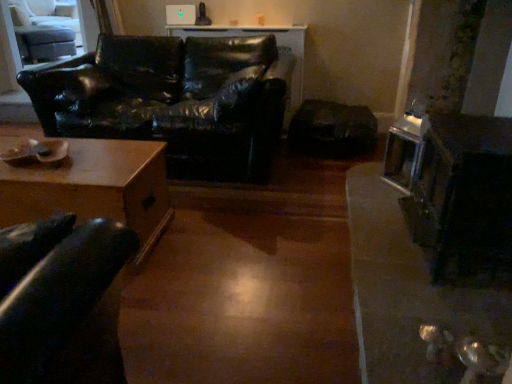
Locate an element on the screen. metallic silver fireplace at right is located at coordinates (460, 197).

Find the location of a particular element. wooden table at lower left is located at coordinates (95, 188).

Find the location of a particular element. The height and width of the screenshot is (384, 512). light gray fabric swivel chair at upper left is located at coordinates (41, 39).

Is point (42, 59) positioned before point (74, 192)?

That is False.

Does light gray fabric swivel chair at upper left appear on the right side of wooden table at lower left?

In fact, light gray fabric swivel chair at upper left is to the left of wooden table at lower left.

Is light gray fabric swivel chair at upper left situated inside wooden table at lower left or outside?

The correct answer is: outside.

You are a GUI agent. You are given a task and a screenshot of the screen. Output one action in this format:
    pyautogui.click(x=<x>, y=<y>)
    Task: Click on the swivel chair above the metallic silver fireplace at right (from the image's perspective)
    The width and height of the screenshot is (512, 384).
    Given the screenshot: What is the action you would take?
    (x=41, y=39)

From the image's perspective, is light gray fabric swivel chair at upper left positioned above or below metallic silver fireplace at right?

light gray fabric swivel chair at upper left is above metallic silver fireplace at right.

Does point (61, 54) appear closer or farther from the camera than point (454, 231)?

Clearly, point (61, 54) is more distant from the camera than point (454, 231).

Are light gray fabric swivel chair at upper left and metallic silver fireplace at right far apart?

light gray fabric swivel chair at upper left is positioned a significant distance from metallic silver fireplace at right.

Which of these two, wooden table at lower left or light gray fabric swivel chair at upper left, is wider?

With larger width is wooden table at lower left.

Looking at this image, from a real-world perspective, which is physically below, wooden table at lower left or light gray fabric swivel chair at upper left?

wooden table at lower left, from a real-world perspective.

Is wooden table at lower left inside or outside of light gray fabric swivel chair at upper left?

wooden table at lower left cannot be found inside light gray fabric swivel chair at upper left.

From the image's perspective, is black leather couch at left above light gray fabric swivel chair at upper left?

Actually, black leather couch at left appears below light gray fabric swivel chair at upper left in the image.

Who is shorter, black leather couch at left or light gray fabric swivel chair at upper left?

light gray fabric swivel chair at upper left.

From the picture: Which object is positioned more to the right, black leather couch at left or light gray fabric swivel chair at upper left?

black leather couch at left.

Does black leather couch at left have a smaller size compared to light gray fabric swivel chair at upper left?

Actually, black leather couch at left might be larger than light gray fabric swivel chair at upper left.

Is wooden table at lower left not within metallic silver fireplace at right?

wooden table at lower left lies outside metallic silver fireplace at right's area.

Considering the relative sizes of wooden table at lower left and metallic silver fireplace at right in the image provided, is wooden table at lower left taller than metallic silver fireplace at right?

Incorrect, the height of wooden table at lower left is not larger of that of metallic silver fireplace at right.

Looking at this image, from the image's perspective, who appears lower, wooden table at lower left or metallic silver fireplace at right?

From the image's view, wooden table at lower left is below.

Looking at this image, is wooden table at lower left looking in the opposite direction of metallic silver fireplace at right?

No, wooden table at lower left is not facing away from metallic silver fireplace at right.

Considering the relative positions of black leather couch at left and wooden table at lower left in the image provided, is black leather couch at left to the right of wooden table at lower left from the viewer's perspective?

Indeed, black leather couch at left is positioned on the right side of wooden table at lower left.

In the scene shown: Who is bigger, black leather couch at left or wooden table at lower left?

black leather couch at left.

Considering the sizes of black leather couch at left and wooden table at lower left in the image, is black leather couch at left taller or shorter than wooden table at lower left?

Considering their sizes, black leather couch at left has more height than wooden table at lower left.

Considering the positions of objects black leather couch at left and wooden table at lower left in the image provided, who is in front, black leather couch at left or wooden table at lower left?

Positioned in front is wooden table at lower left.

How distant is black leather couch at left from metallic silver fireplace at right?

black leather couch at left and metallic silver fireplace at right are 1.58 meters apart from each other.

Is black leather couch at left in contact with metallic silver fireplace at right?

No.

Considering the positions of points (59, 125) and (487, 258), is point (59, 125) farther from camera compared to point (487, 258)?

Yes.

At what (x,y) coordinates should I click in order to perform the action: click on swivel chair behind the wooden table at lower left. Please return your answer as a coordinate pair (x, y). Image resolution: width=512 pixels, height=384 pixels. Looking at the image, I should click on (41, 39).

Locate an element on the screen. The width and height of the screenshot is (512, 384). appliance beneath the light gray fabric swivel chair at upper left (from a real-world perspective) is located at coordinates (460, 197).

Based on their spatial positions, is metallic silver fireplace at right or black leather couch at left closer to wooden table at lower left?

Among the two, black leather couch at left is located nearer to wooden table at lower left.

Considering their positions, is black leather couch at left positioned closer to light gray fabric swivel chair at upper left than metallic silver fireplace at right?

black leather couch at left.

Looking at the image, which one is located further to light gray fabric swivel chair at upper left, metallic silver fireplace at right or wooden table at lower left?

metallic silver fireplace at right is positioned further to the anchor light gray fabric swivel chair at upper left.

In the scene shown: When comparing their distances from black leather couch at left, does light gray fabric swivel chair at upper left or metallic silver fireplace at right seem closer?

Based on the image, metallic silver fireplace at right appears to be nearer to black leather couch at left.

Estimate the real-world distances between objects in this image. Which object is further from metallic silver fireplace at right, black leather couch at left or wooden table at lower left?

Among the two, black leather couch at left is located further to metallic silver fireplace at right.

When comparing their distances from metallic silver fireplace at right, does light gray fabric swivel chair at upper left or black leather couch at left seem further?

light gray fabric swivel chair at upper left is further to metallic silver fireplace at right.

Estimate the real-world distances between objects in this image. Which object is closer to light gray fabric swivel chair at upper left, metallic silver fireplace at right or black leather couch at left?

black leather couch at left is positioned closer to the anchor light gray fabric swivel chair at upper left.

Estimate the real-world distances between objects in this image. Which object is further from black leather couch at left, wooden table at lower left or light gray fabric swivel chair at upper left?

light gray fabric swivel chair at upper left.

Image resolution: width=512 pixels, height=384 pixels. I want to click on studio couch located between wooden table at lower left and metallic silver fireplace at right in the left-right direction, so click(x=170, y=101).

Locate an element on the screen. table between light gray fabric swivel chair at upper left and metallic silver fireplace at right from left to right is located at coordinates (95, 188).

Where is `studio couch between light gray fabric swivel chair at upper left and metallic silver fireplace at right`? This screenshot has width=512, height=384. studio couch between light gray fabric swivel chair at upper left and metallic silver fireplace at right is located at coordinates (170, 101).

Image resolution: width=512 pixels, height=384 pixels. Identify the location of studio couch positioned between wooden table at lower left and light gray fabric swivel chair at upper left from near to far. (170, 101).